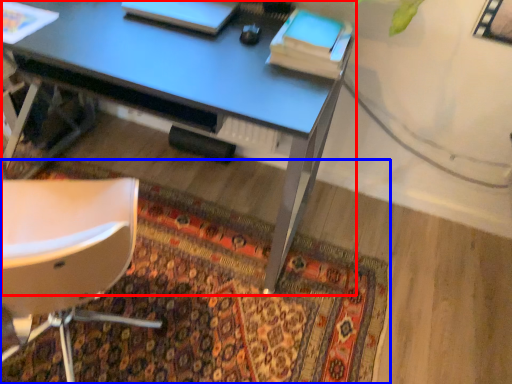
Question: Which of the following is the closest to the observer, desk (highlighted by a red box) or mat (highlighted by a blue box)?

Choices:
 (A) desk
 (B) mat

Answer: (A)